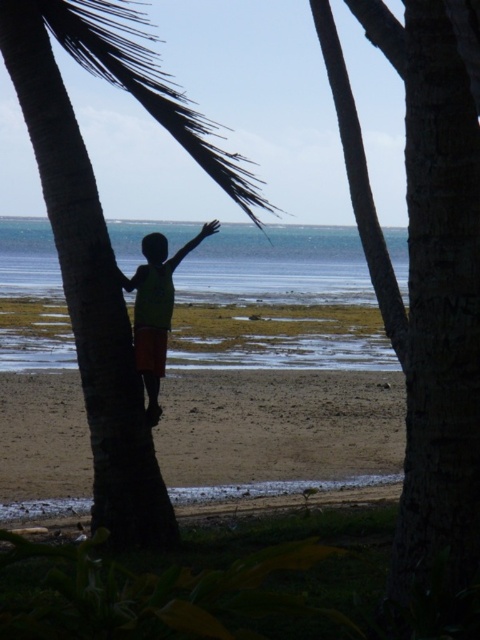
You are a photographer trying to capture the scene of the brown rough palm tree at left and the green fabric shirt at center. Which object would require a wider lens to capture its full width in the photo?

The brown rough palm tree at left has a larger width than the green fabric shirt at center, so it would require a wider lens to capture its full width in the photo.

You are standing on the beach and want to reach the two points marked in the image. Which point, point (x=70, y=141) or point (x=156, y=353), is closer to you?

Point (x=70, y=141) is closer to the viewer than point (x=156, y=353).